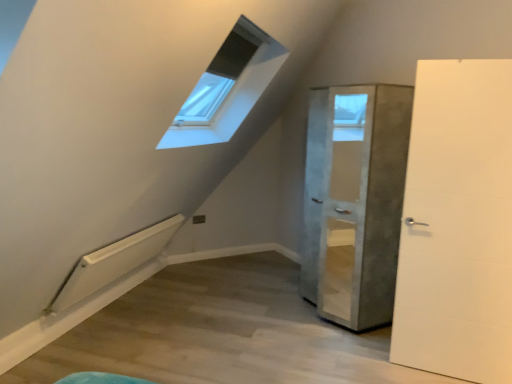
Question: From the image's perspective, is white matte door at right, marked as the 2th door in a back-to-front arrangement, positioned above or below concrete textured cabinet at center, positioned as the 1th door in back-to-front order?

Choices:
 (A) below
 (B) above

Answer: (A)

Question: Relative to concrete textured cabinet at center, the second door when ordered from front to back, is white matte door at right, which is the 1th door from front to back, in front or behind?

Choices:
 (A) behind
 (B) front

Answer: (B)

Question: Considering the positions of white matte door at right, which is the 1th door from front to back, and concrete textured cabinet at center, positioned as the 1th door in back-to-front order, in the image, is white matte door at right, which is the 1th door from front to back, wider or thinner than concrete textured cabinet at center, positioned as the 1th door in back-to-front order,?

Choices:
 (A) wide
 (B) thin

Answer: (B)

Question: Does point (330, 188) appear closer or farther from the camera than point (508, 251)?

Choices:
 (A) farther
 (B) closer

Answer: (A)

Question: Would you say concrete textured cabinet at center, the second door when ordered from front to back, is inside or outside white matte door at right, marked as the 2th door in a back-to-front arrangement?

Choices:
 (A) inside
 (B) outside

Answer: (B)

Question: From a real-world perspective, is concrete textured cabinet at center, the second door when ordered from front to back, positioned above or below white matte door at right, marked as the 2th door in a back-to-front arrangement?

Choices:
 (A) below
 (B) above

Answer: (A)

Question: Looking at their shapes, would you say concrete textured cabinet at center, positioned as the 1th door in back-to-front order, is wider or thinner than white matte door at right, which is the 1th door from front to back?

Choices:
 (A) wide
 (B) thin

Answer: (A)